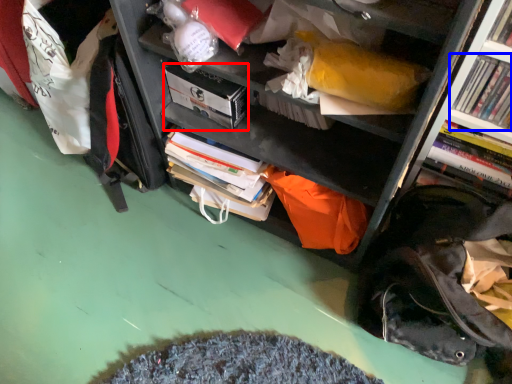
Question: Among these objects, which one is farthest to the camera, paperback book (highlighted by a red box) or book (highlighted by a blue box)?

Choices:
 (A) paperback book
 (B) book

Answer: (A)